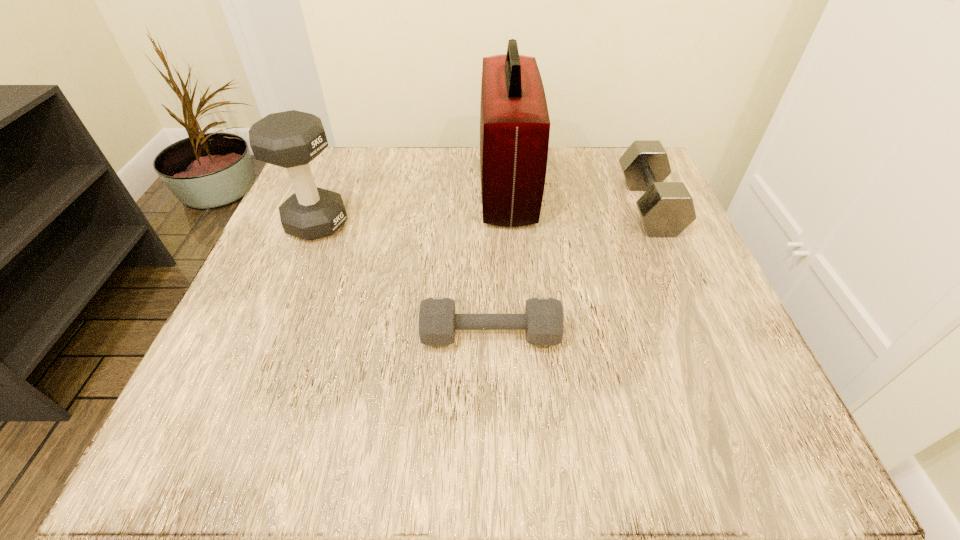
I want to click on vacant area at the left edge, so click(344, 247).

At what (x,y) coordinates should I click in order to perform the action: click on vacant space at the right edge of the desktop. Please return your answer as a coordinate pair (x, y). This screenshot has height=540, width=960. Looking at the image, I should click on (668, 324).

At what (x,y) coordinates should I click in order to perform the action: click on vacant space at the far left corner. Please return your answer as a coordinate pair (x, y). Looking at the image, I should click on (317, 172).

Identify the location of vacant space at the near left corner. (256, 409).

Find the location of `empty space between the rightmost object and the leftmost dumbbell`. empty space between the rightmost object and the leftmost dumbbell is located at coordinates (483, 214).

Locate an element on the screen. The image size is (960, 540). vacant area that lies between the nearest dumbbell and the tallest object is located at coordinates (499, 261).

The width and height of the screenshot is (960, 540). Find the location of `empty space between the second tallest object and the second dumbbell from right to left`. empty space between the second tallest object and the second dumbbell from right to left is located at coordinates (403, 279).

Where is `free point between the second dumbbell from left to right and the rightmost dumbbell`? This screenshot has height=540, width=960. free point between the second dumbbell from left to right and the rightmost dumbbell is located at coordinates pyautogui.click(x=569, y=271).

The image size is (960, 540). Find the location of `free space that is in between the tallest dumbbell and the rightmost dumbbell`. free space that is in between the tallest dumbbell and the rightmost dumbbell is located at coordinates (483, 214).

Locate an element on the screen. This screenshot has width=960, height=540. unoccupied area between the first aid kit and the nearest dumbbell is located at coordinates click(499, 261).